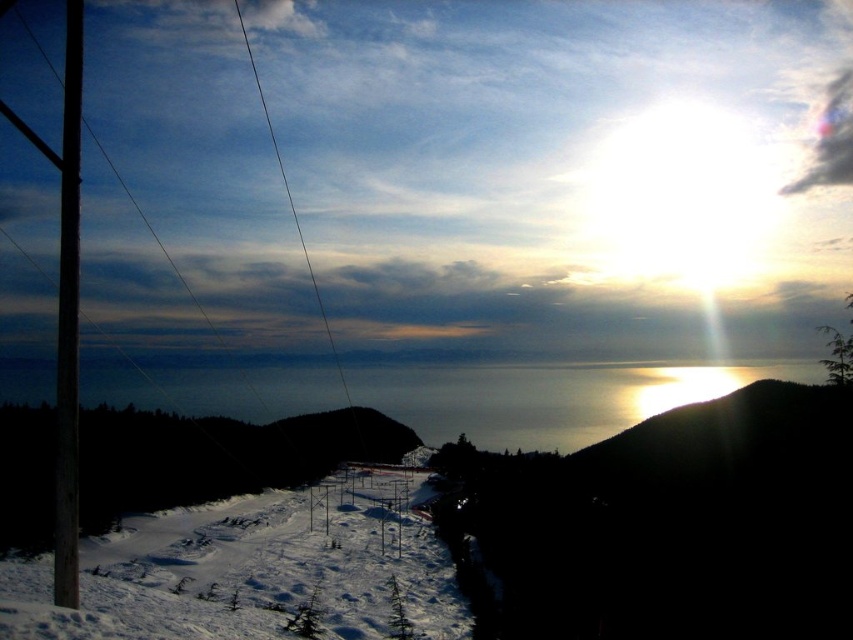
Between silvery metallic hillside at upper right and smooth wooden pole at left, which one is positioned higher?

smooth wooden pole at left is higher up.

Consider the image. Is silvery metallic hillside at upper right taller than smooth wooden pole at left?

In fact, silvery metallic hillside at upper right may be shorter than smooth wooden pole at left.

At what (x,y) coordinates should I click in order to perform the action: click on silvery metallic hillside at upper right. Please return your answer as a coordinate pair (x, y). Looking at the image, I should click on (665, 524).

Where is `silvery metallic hillside at upper right`? silvery metallic hillside at upper right is located at coordinates (665, 524).

Can you confirm if silvery metallic hillside at upper right is bigger than smooth wire at center?

Indeed, silvery metallic hillside at upper right has a larger size compared to smooth wire at center.

Which of these two, silvery metallic hillside at upper right or smooth wire at center, stands taller?

Standing taller between the two is smooth wire at center.

Between point (714, 508) and point (276, 156), which one is positioned behind?

The point (276, 156) is behind.

Find the location of a particular element. The width and height of the screenshot is (853, 640). silvery metallic hillside at upper right is located at coordinates (665, 524).

Is white snow ski slope at center thinner than smooth wire at center?

In fact, white snow ski slope at center might be wider than smooth wire at center.

Is white snow ski slope at center behind smooth wire at center?

No, it is in front of smooth wire at center.

Describe the element at coordinates (256, 570) in the screenshot. Image resolution: width=853 pixels, height=640 pixels. I see `white snow ski slope at center` at that location.

Where is `white snow ski slope at center`? This screenshot has height=640, width=853. white snow ski slope at center is located at coordinates (256, 570).